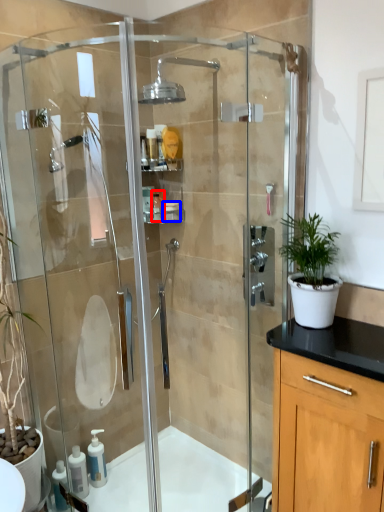
Question: Which object is further to the camera taking this photo, toiletry (highlighted by a red box) or toiletry (highlighted by a blue box)?

Choices:
 (A) toiletry
 (B) toiletry

Answer: (A)